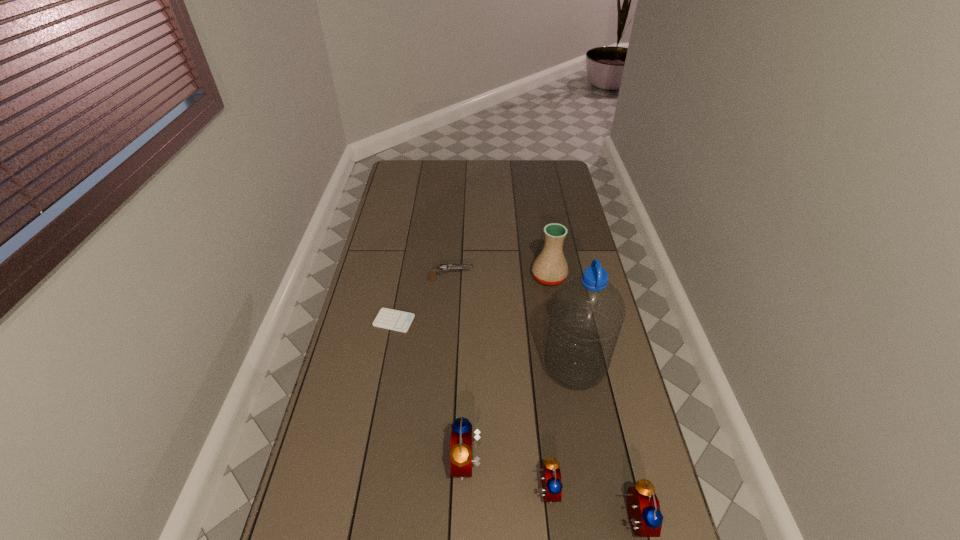
With all alarm clocks evenly spaced, where should an extra alarm clock be placed on the left to continue the pattern? Please point out a vacant space. Please provide its 2D coordinates. Your answer should be formatted as a tuple, i.e. [(x, y)], where the tuple contains the x and y coordinates of a point satisfying the conditions above.

[(393, 438)]